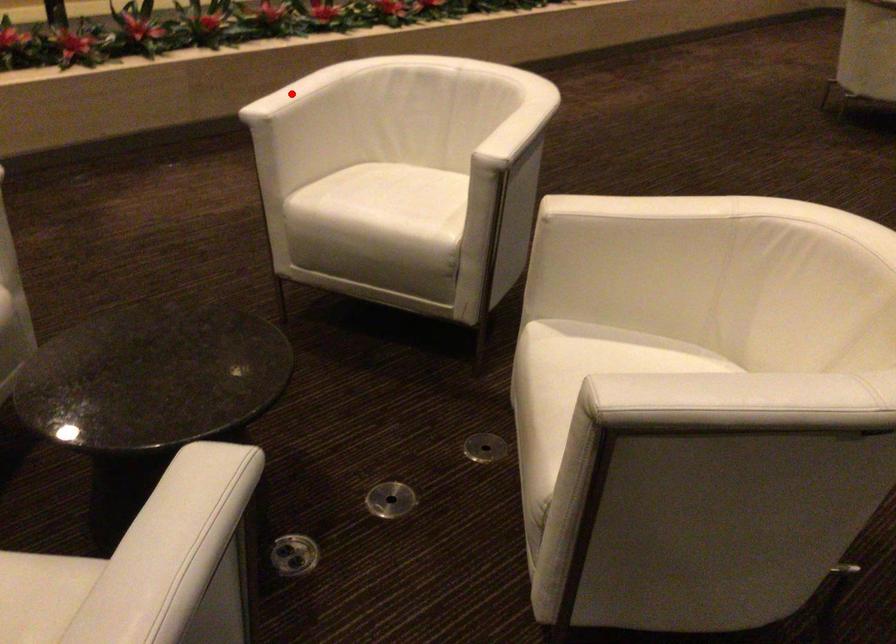
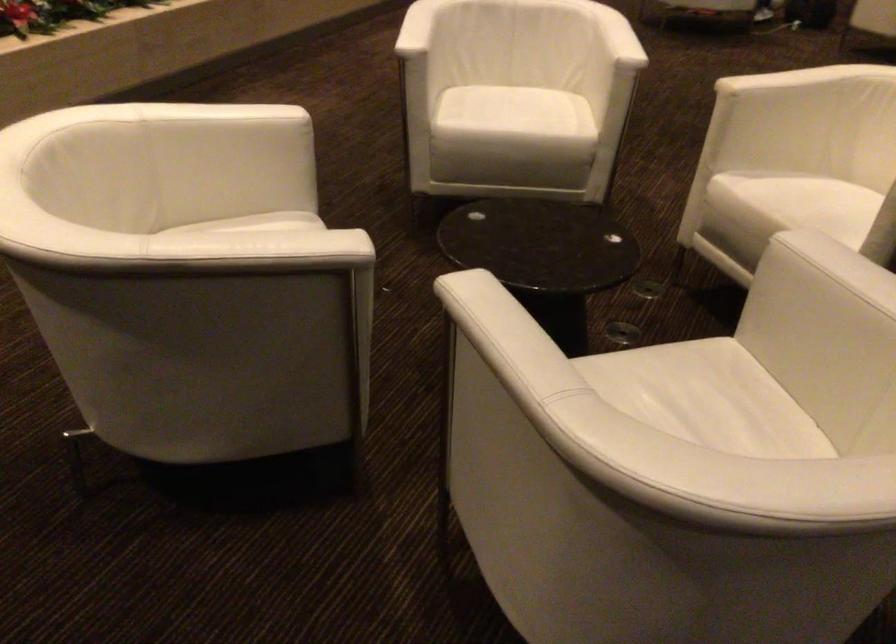
Locate, in the second image, the point that corresponds to the highlighted location in the first image.

(417, 28)